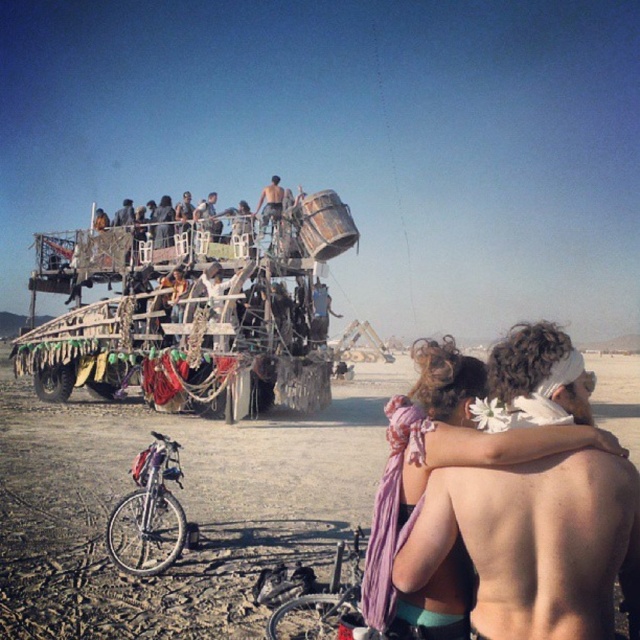
Is dirt field at lower center closer to camera compared to wooden plank at center?

Yes, dirt field at lower center is in front of wooden plank at center.

Can you confirm if dirt field at lower center is positioned to the left of wooden plank at center?

Incorrect, dirt field at lower center is not on the left side of wooden plank at center.

Find the location of a particular element. dirt field at lower center is located at coordinates (182, 502).

Is point (61, 481) positioned in front of point (593, 460)?

No, (61, 481) is further to viewer.

Identify the location of dirt field at lower center. The image size is (640, 640). (182, 502).

Does dirt field at lower center have a smaller size compared to shiny metallic tank top at center?

No, dirt field at lower center is not smaller than shiny metallic tank top at center.

Between point (74, 636) and point (276, 209), which one is positioned behind?

The point (276, 209) is behind.

Which is behind, point (20, 554) or point (273, 212)?

Point (273, 212)

Image resolution: width=640 pixels, height=640 pixels. I want to click on dirt field at lower center, so click(182, 502).